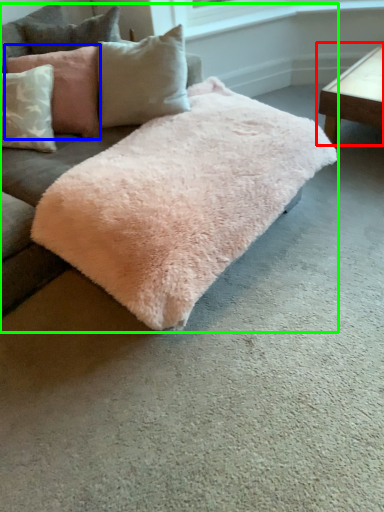
Question: Which object is the farthest from table (highlighted by a red box)? Choose among these: pillow (highlighted by a blue box) or studio couch (highlighted by a green box).

Choices:
 (A) pillow
 (B) studio couch

Answer: (A)